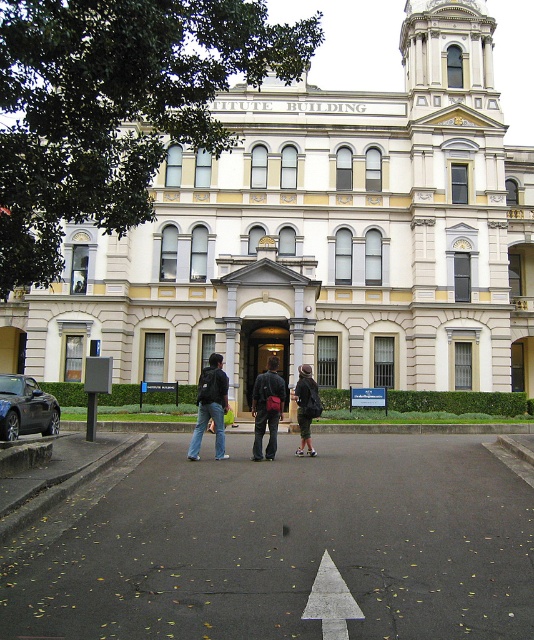
You are standing 10 meters away from the building and see the matte black backpack at center. Can you safely walk towards the backpack without getting too close to the building?

The matte black backpack at center is 12.10 meters away from the viewer. Since you are already 10 meters away from the building, you can safely walk towards the backpack as it is further away from you than the building, maintaining a safe distance.

You are a delivery person holding a package that is 1.5 meters long. You need to place it between the matte black backpack at center and the dark gray fabric jacket at center. Is there enough space between them to fit the package?

The distance between the matte black backpack at center and the dark gray fabric jacket at center is 1.84 meters. Since the package is 1.5 meters long, there is enough space to fit it between them.